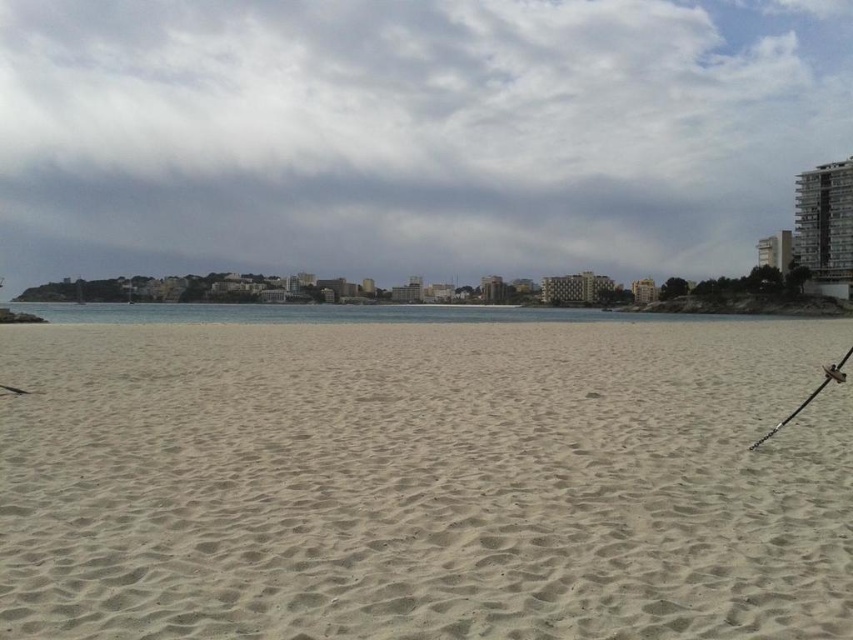
Is light beige sand at center positioned at the back of gray concrete building at upper right?

No, light beige sand at center is in front of gray concrete building at upper right.

You are a GUI agent. You are given a task and a screenshot of the screen. Output one action in this format:
    pyautogui.click(x=<x>, y=<y>)
    Task: Click on the light beige sand at center
    This screenshot has width=853, height=640.
    Given the screenshot: What is the action you would take?
    pyautogui.click(x=424, y=481)

At what (x,y) coordinates should I click in order to perform the action: click on light beige sand at center. Please return your answer as a coordinate pair (x, y). Looking at the image, I should click on (424, 481).

Is clear water at center taller than metallic fishing pole at lower right?

Indeed, clear water at center has a greater height compared to metallic fishing pole at lower right.

Between point (201, 305) and point (827, 372), which one is positioned behind?

Positioned behind is point (201, 305).

Between point (520, 320) and point (828, 381), which one is positioned behind?

Positioned behind is point (520, 320).

At what (x,y) coordinates should I click in order to perform the action: click on clear water at center. Please return your answer as a coordinate pair (x, y). Looking at the image, I should click on coord(335,314).

Is clear water at center further to camera compared to gray concrete building at upper right?

No.

Describe the element at coordinates (335, 314) in the screenshot. This screenshot has width=853, height=640. I see `clear water at center` at that location.

Where is `clear water at center`? This screenshot has width=853, height=640. clear water at center is located at coordinates (335, 314).

Locate an element on the screen. clear water at center is located at coordinates (335, 314).